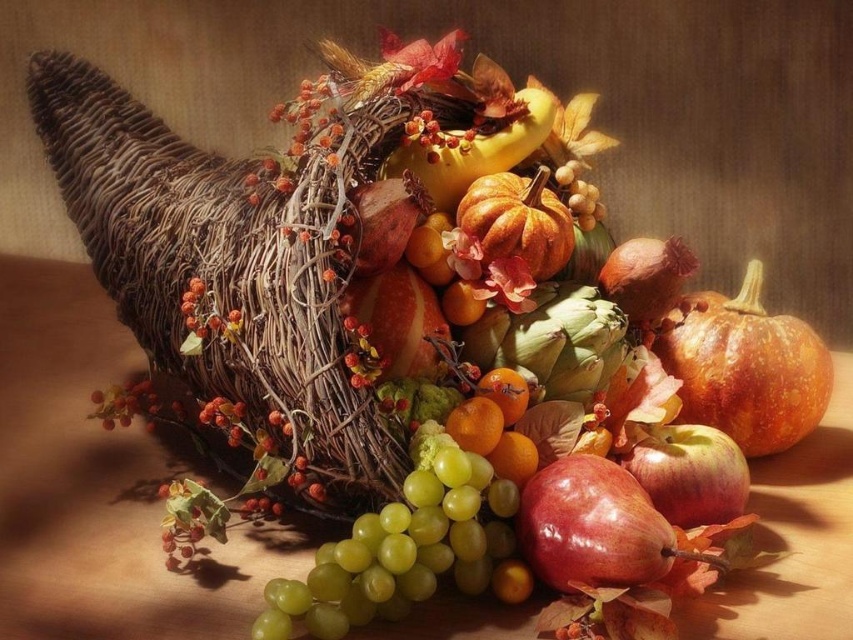
Is green matte grapes at center bigger than matte orange pumpkin at center?

Yes.

Between point (368, 548) and point (491, 192), which one is positioned in front?

Point (368, 548) is more forward.

This screenshot has height=640, width=853. Identify the location of green matte grapes at center. (402, 547).

Between speckled orange pumpkin at center and matte orange pumpkin at center, which one appears on the right side from the viewer's perspective?

Positioned to the right is speckled orange pumpkin at center.

The height and width of the screenshot is (640, 853). In order to click on speckled orange pumpkin at center in this screenshot , I will do `click(746, 368)`.

Is speckled orange pumpkin at center below glossy red apple at center?

Actually, speckled orange pumpkin at center is above glossy red apple at center.

Based on the photo, does speckled orange pumpkin at center lie in front of glossy red apple at center?

No, speckled orange pumpkin at center is further to the viewer.

Does point (833, 381) come closer to viewer compared to point (675, 499)?

No, it is behind (675, 499).

Where is `speckled orange pumpkin at center`? This screenshot has width=853, height=640. speckled orange pumpkin at center is located at coordinates (746, 368).